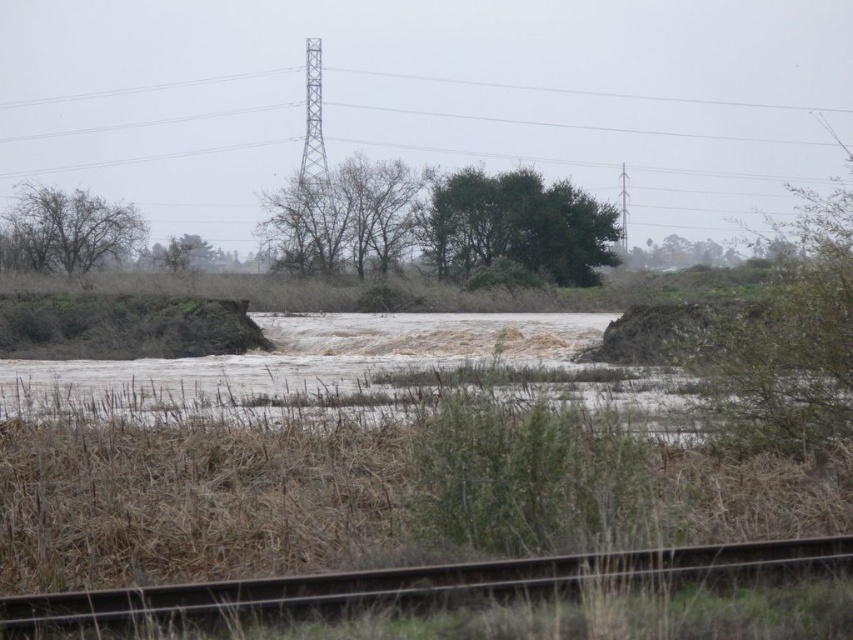
Question: Does rusty metal train track at lower center appear under green leafy tree at left?

Choices:
 (A) yes
 (B) no

Answer: (A)

Question: Which point is closer to the camera taking this photo?

Choices:
 (A) coord(592,232)
 (B) coord(331,588)

Answer: (B)

Question: Which point appears closest to the camera in this image?

Choices:
 (A) (364, 260)
 (B) (36, 198)

Answer: (A)

Question: Is rusty metal train track at lower center to the left of bare branches at center from the viewer's perspective?

Choices:
 (A) no
 (B) yes

Answer: (A)

Question: Which point is closer to the camera?

Choices:
 (A) rusty metal train track at lower center
 (B) bare branches at center
 (C) green leafy tree at left
 (D) green leafy tree at center

Answer: (A)

Question: Is rusty metal train track at lower center to the right of green leafy tree at left from the viewer's perspective?

Choices:
 (A) yes
 (B) no

Answer: (A)